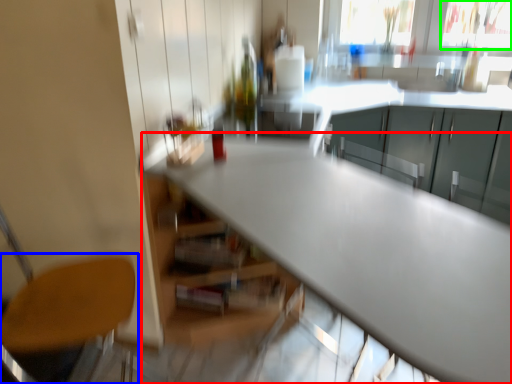
Question: Which object is positioned farthest from table (highlighted by a red box)? Select from chair (highlighted by a blue box) and window screen (highlighted by a green box).

Choices:
 (A) chair
 (B) window screen

Answer: (B)